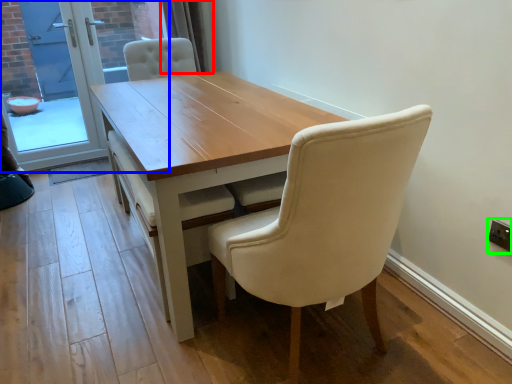
Question: Considering the real-world distances, which object is closest to curtain (highlighted by a red box)? screen door (highlighted by a blue box) or electric outlet (highlighted by a green box).

Choices:
 (A) screen door
 (B) electric outlet

Answer: (A)